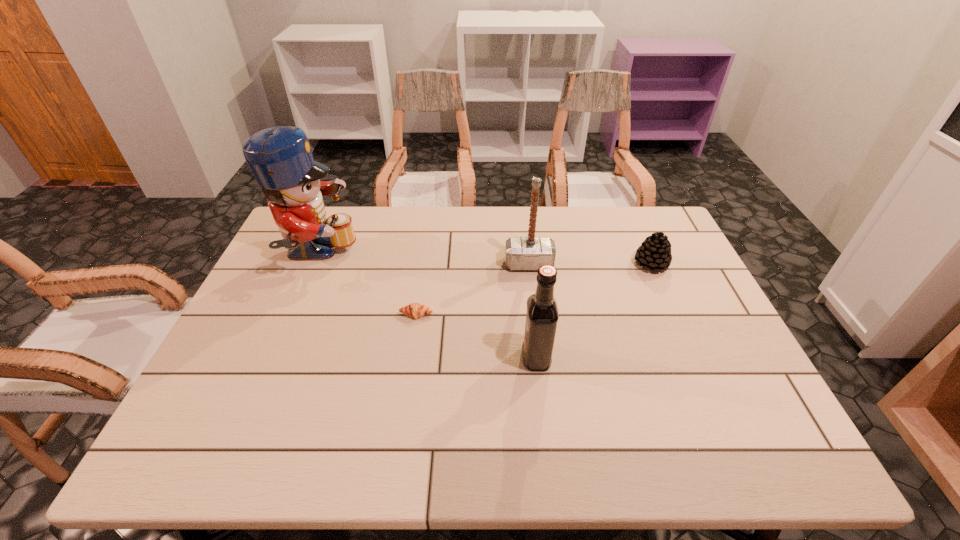
Where is `blank space at the near edge of the desktop`? The image size is (960, 540). blank space at the near edge of the desktop is located at coordinates (678, 429).

The height and width of the screenshot is (540, 960). I want to click on vacant position at the left edge of the desktop, so click(x=292, y=308).

What are the coordinates of `free location at the right edge` in the screenshot? It's located at (694, 303).

Identify the location of vacant space at the far right corner. The width and height of the screenshot is (960, 540). (656, 217).

Locate an element on the screen. vacant space at the near right corner of the desktop is located at coordinates (768, 440).

In order to click on free space that is in between the tallest object and the liquor in this screenshot , I will do `click(427, 306)`.

In order to click on free space that is in between the pastry and the liquor in this screenshot , I will do `click(476, 336)`.

Image resolution: width=960 pixels, height=540 pixels. Identify the location of free space between the nearest object and the rightmost object. (593, 311).

The image size is (960, 540). I want to click on empty location between the second shortest object and the hammer, so click(x=590, y=264).

The height and width of the screenshot is (540, 960). I want to click on free spot between the nutcracker and the liquor, so click(427, 306).